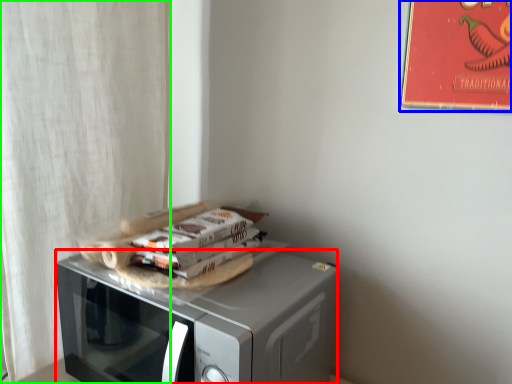
Question: Based on their relative distances, which object is farther from microwave oven (highlighted by a red box)? Choose from bulletin board (highlighted by a blue box) and curtain (highlighted by a green box).

Choices:
 (A) bulletin board
 (B) curtain

Answer: (A)